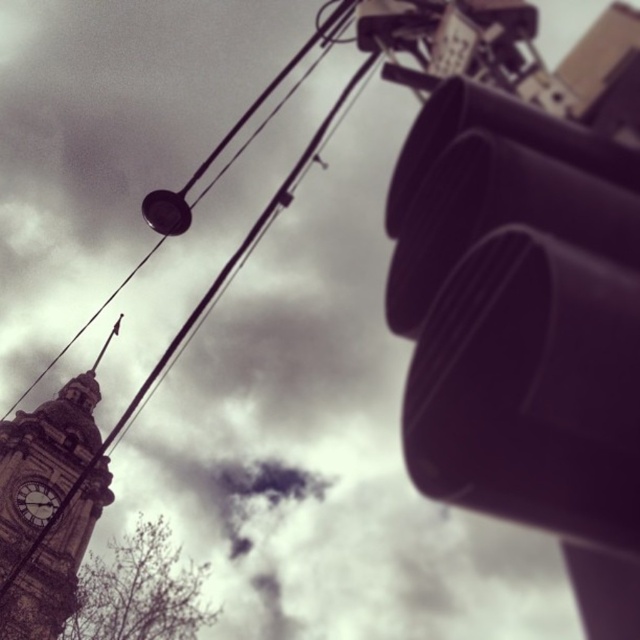
In the scene shown: You are a city planner assessing the width of structures in the scene. Given that the brown stone clock tower at left and the dark gray stone clock at lower left are both key landmarks, which one has a greater width?

The brown stone clock tower at left has a greater width than the dark gray stone clock at lower left as per the description.

You are a delivery drone flying over the urban scene. You need to land on the closest object between the matte black traffic light at right and the dark gray stone clock at lower left. Which object should you choose?

The matte black traffic light at right is closer to the viewer than the dark gray stone clock at lower left, so you should land on the matte black traffic light at right.